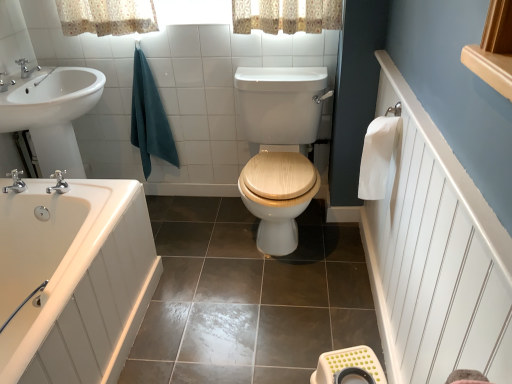
What are the coordinates of `unoccupied region to the right of silver metallic faucet at left, which is the first tap in bottom-to-top order` in the screenshot? It's located at (48, 185).